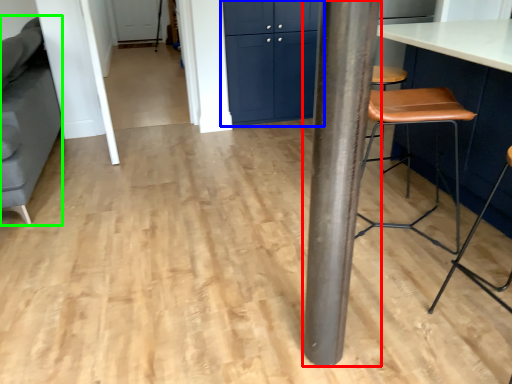
Question: Which is nearer to the pillar (highlighted by a red box)? cabinetry (highlighted by a blue box) or swivel chair (highlighted by a green box).

Choices:
 (A) cabinetry
 (B) swivel chair

Answer: (B)